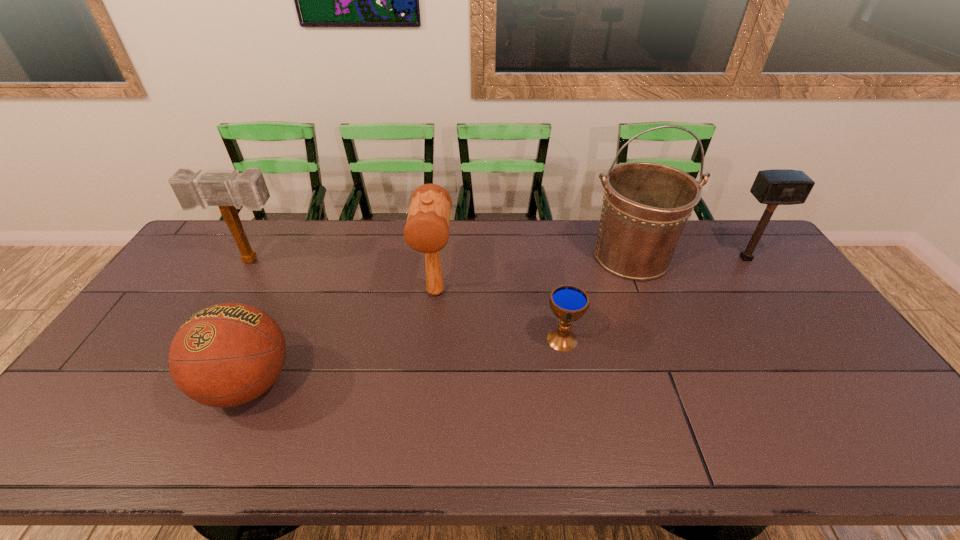
You are a GUI agent. You are given a task and a screenshot of the screen. Output one action in this format:
    pyautogui.click(x=<x>, y=<y>)
    Task: Click on the object located in the far right corner section of the desktop
    
    Given the screenshot: What is the action you would take?
    pyautogui.click(x=774, y=187)

The image size is (960, 540). In the image, there is a desktop. Identify the location of vacant region at the far edge. (505, 242).

In the image, there is a desktop. What are the coordinates of `vacant region at the near edge` in the screenshot? It's located at (660, 452).

What are the coordinates of `vacant area at the left edge of the desktop` in the screenshot? It's located at (196, 280).

The image size is (960, 540). In the image, there is a desktop. Identify the location of free space at the far right corner. (751, 229).

Where is `free spot between the leftmost mallet and the rightmost object`? free spot between the leftmost mallet and the rightmost object is located at coordinates (499, 260).

Image resolution: width=960 pixels, height=540 pixels. Identify the location of free space between the second mallet from left to right and the fifth object from left to right. (534, 274).

At what (x,y) coordinates should I click in order to perform the action: click on empty space between the fourth object from left to right and the nearest mallet. Please return your answer as a coordinate pair (x, y). Looking at the image, I should click on (499, 316).

At what (x,y) coordinates should I click in order to perform the action: click on free space between the leftmost mallet and the fifth object from left to right. Please return your answer as a coordinate pair (x, y). This screenshot has width=960, height=540. Looking at the image, I should click on (442, 259).

Locate an element on the screen. Image resolution: width=960 pixels, height=540 pixels. vacant area that lies between the tallest object and the nearest mallet is located at coordinates (534, 274).